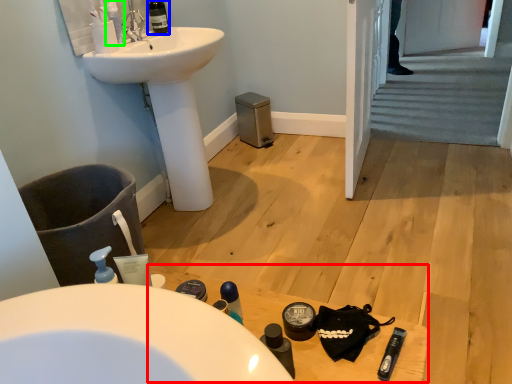
Question: Which object is positioned closest to table (highlighted by a red box)? Select from wine bottle (highlighted by a blue box) and mouthwash (highlighted by a green box).

Choices:
 (A) wine bottle
 (B) mouthwash

Answer: (B)